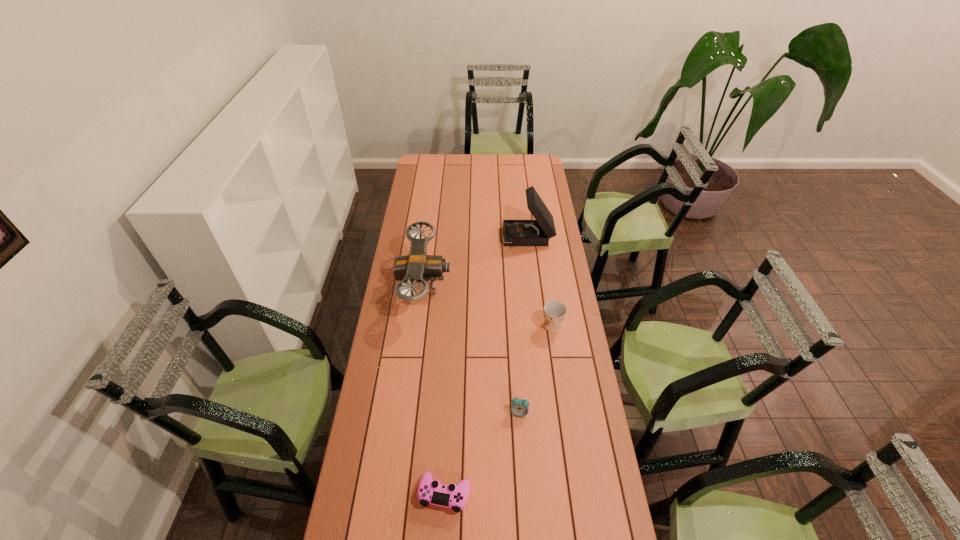
Find the location of a particular element. The height and width of the screenshot is (540, 960). free point at the far left corner is located at coordinates (420, 163).

The image size is (960, 540). I want to click on vacant point located between the shortest object and the tallest object, so click(487, 366).

I want to click on vacant space in between the drone and the nearest object, so click(435, 389).

Locate an element on the screen. The width and height of the screenshot is (960, 540). vacant space in between the nearest object and the phonograph_record is located at coordinates (487, 366).

Where is `free spot between the control and the third shortest object`? Image resolution: width=960 pixels, height=540 pixels. free spot between the control and the third shortest object is located at coordinates (498, 410).

Find the location of `vacant space in between the Dixie cup and the phonograph_record`. vacant space in between the Dixie cup and the phonograph_record is located at coordinates (540, 282).

This screenshot has height=540, width=960. In order to click on free space between the Dixie cup and the nearest object in this screenshot , I will do `click(498, 410)`.

Where is `empty space between the fourth farthest object and the second tallest object`? This screenshot has width=960, height=540. empty space between the fourth farthest object and the second tallest object is located at coordinates (471, 349).

Image resolution: width=960 pixels, height=540 pixels. I want to click on empty location between the Dixie cup and the drone, so click(489, 306).

Identify the location of vacant area that lies between the tallest object and the fourth shortest object. The height and width of the screenshot is (540, 960). (476, 262).